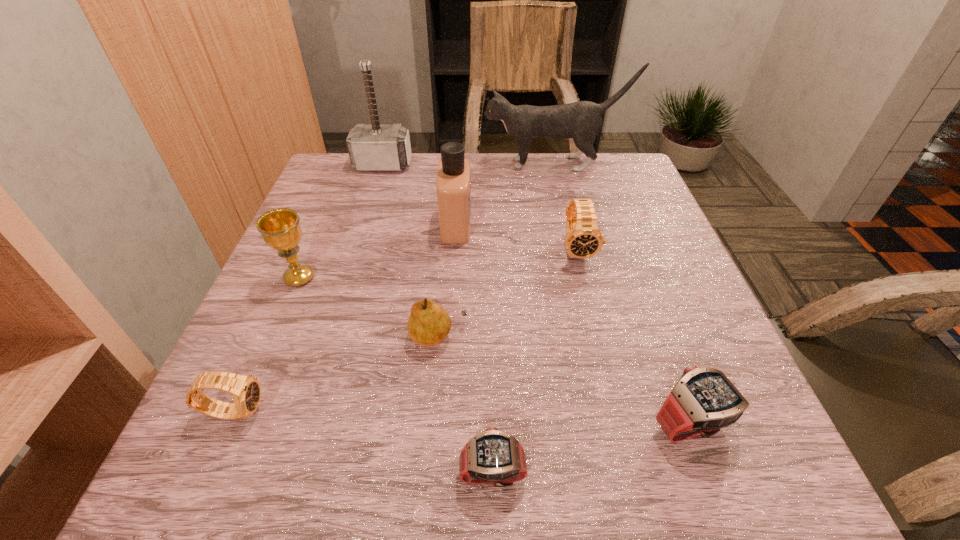
This screenshot has width=960, height=540. I want to click on watch positioned at the left edge, so click(246, 391).

Identify the location of cat present at the right edge. This screenshot has height=540, width=960. (581, 121).

Find the location of a particular element. Image resolution: width=960 pixels, height=540 pixels. watch that is at the right edge is located at coordinates (704, 400).

You are a GUI agent. You are given a task and a screenshot of the screen. Output one action in this format:
    pyautogui.click(x=<x>, y=<y>)
    Task: Click on the object that is at the far left corner
    Image resolution: width=960 pixels, height=540 pixels.
    Given the screenshot: What is the action you would take?
    pyautogui.click(x=374, y=147)

This screenshot has height=540, width=960. Identify the location of object located in the far right corner section of the desktop. (581, 121).

Where is `object that is at the near right corner`? object that is at the near right corner is located at coordinates pyautogui.click(x=704, y=400).

In the image, there is a desktop. Where is `free space at the far edge`? free space at the far edge is located at coordinates (379, 186).

The width and height of the screenshot is (960, 540). In the image, there is a desktop. Find the location of `vacant region at the near edge`. vacant region at the near edge is located at coordinates (579, 470).

Where is `vacant region at the left edge of the desktop`? The height and width of the screenshot is (540, 960). vacant region at the left edge of the desktop is located at coordinates (366, 225).

The image size is (960, 540). Find the location of `free space at the right edge of the desktop`. free space at the right edge of the desktop is located at coordinates (614, 262).